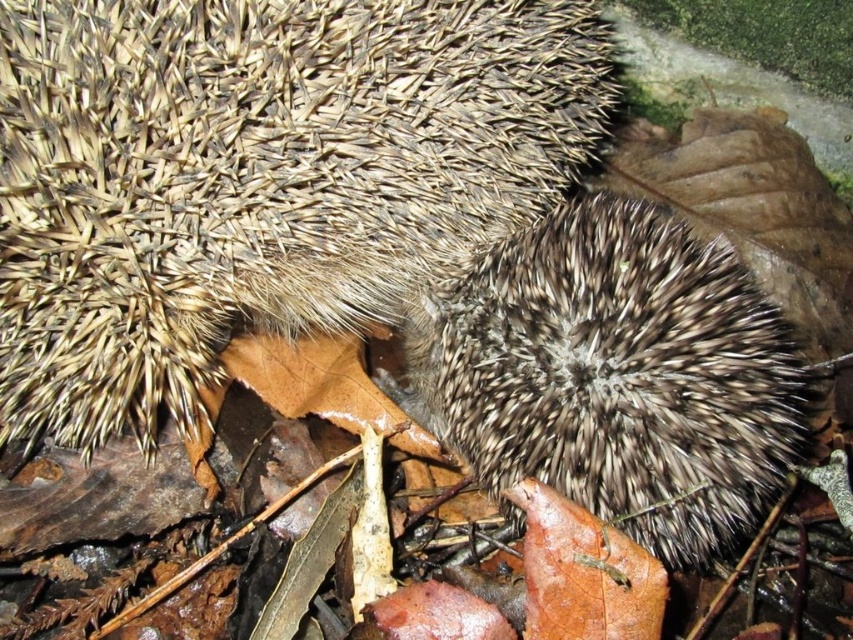
Question: Can you confirm if brown spiny hedgehog at center is positioned below spiky brown hedgehog at center?

Choices:
 (A) no
 (B) yes

Answer: (A)

Question: Is the position of brown spiny hedgehog at center less distant than that of spiky brown hedgehog at center?

Choices:
 (A) yes
 (B) no

Answer: (A)

Question: Which point is farther to the camera?

Choices:
 (A) (717, 365)
 (B) (335, 228)

Answer: (B)

Question: Does brown spiny hedgehog at center appear under spiky brown hedgehog at center?

Choices:
 (A) no
 (B) yes

Answer: (A)